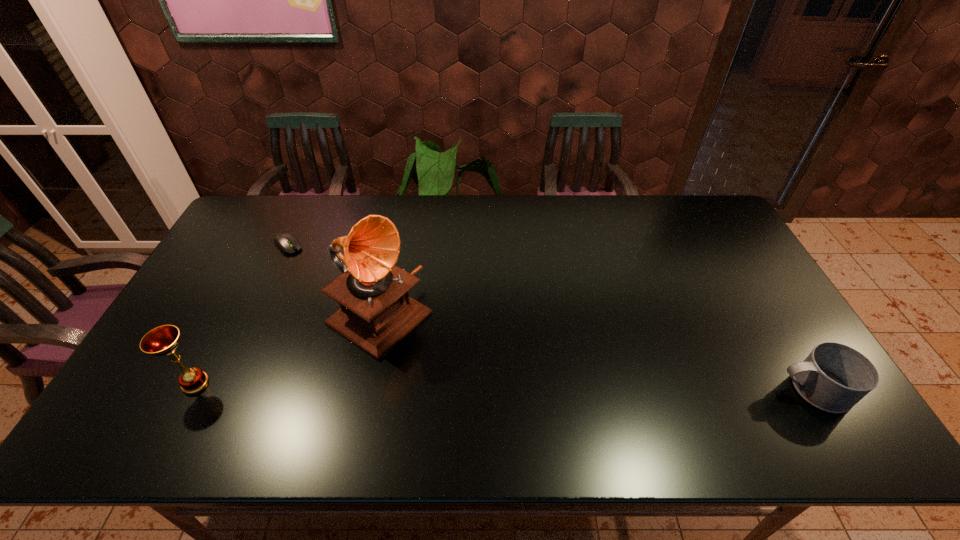
Find the location of a particular element. free region that satisfies the following two spatial constraints: 1. on the front side of the second shortest object; 2. on the side of the shortest object with the handle is located at coordinates (220, 389).

I want to click on vacant space that satisfies the following two spatial constraints: 1. on the front side of the third object from left to right; 2. on the side of the mug with the handle, so click(364, 389).

Identify the location of free space that satisfies the following two spatial constraints: 1. on the back side of the chalice; 2. on the left side of the farthest object. (267, 245).